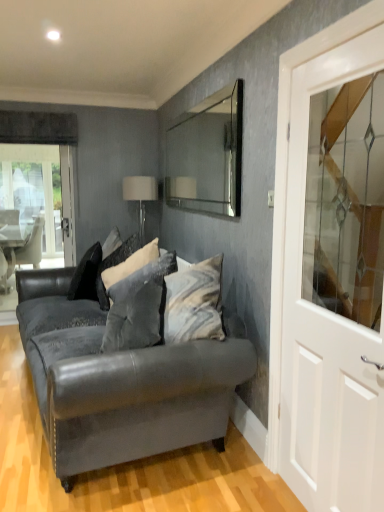
Measure the distance between point (123, 320) and camera.

They are 2.34 meters apart.

Image resolution: width=384 pixels, height=512 pixels. Describe the element at coordinates (138, 307) in the screenshot. I see `velvet gray pillow at center, arranged as the 3th pillow when viewed from the back` at that location.

Identify the location of black velvet pillow at center, which is the 1th pillow in back-to-front order. Image resolution: width=384 pixels, height=512 pixels. (86, 275).

What is the approximate height of velvet dark gray couch at center?

The height of velvet dark gray couch at center is 31.44 inches.

What do you see at coordinates (123, 265) in the screenshot? The height and width of the screenshot is (512, 384). I see `velvet gray pillow at center, placed as the second pillow when sorted from back to front` at bounding box center [123, 265].

Locate an element on the screen. This screenshot has height=512, width=384. velvet gray pillow at center, arranged as the 3th pillow when viewed from the back is located at coordinates pos(138,307).

Which is closer to the camera, (163, 297) or (319, 411)?

Point (163, 297) is positioned farther from the camera compared to point (319, 411).

Is velvet gray pillow at center, arranged as the first pillow when viewed from the front, next to white glossy door at right?

No, velvet gray pillow at center, arranged as the first pillow when viewed from the front, is not making contact with white glossy door at right.

From the image's perspective, which object appears higher, velvet gray pillow at center, arranged as the first pillow when viewed from the front, or white glossy door at right?

From the image's view, white glossy door at right is above.

Is velvet gray pillow at center, arranged as the first pillow when viewed from the front, situated inside white glossy door at right or outside?

The correct answer is: outside.

Locate an element on the screen. Image resolution: width=384 pixels, height=512 pixels. the 2nd pillow below when counting from the black velvet pillow at center, which is the 1th pillow in back-to-front order (from the image's perspective) is located at coordinates (x=138, y=307).

Is velvet gray pillow at center, arranged as the 3th pillow when viewed from the back, facing towards black velvet pillow at center, which is the 1th pillow in back-to-front order?

No, velvet gray pillow at center, arranged as the 3th pillow when viewed from the back, is not turned towards black velvet pillow at center, which is the 1th pillow in back-to-front order.

Could you measure the distance between velvet gray pillow at center, arranged as the first pillow when viewed from the front, and black velvet pillow at center, acting as the third pillow starting from the front?

velvet gray pillow at center, arranged as the first pillow when viewed from the front, is 38.43 inches away from black velvet pillow at center, acting as the third pillow starting from the front.

Is white fabric lampshade at upper center turned away from velvet dark gray couch at center?

white fabric lampshade at upper center is not turned away from velvet dark gray couch at center.

From a real-world perspective, is white fabric lampshade at upper center above or below velvet dark gray couch at center?

white fabric lampshade at upper center is situated higher than velvet dark gray couch at center in the real world.

Consider the image. Which object is positioned more to the right, white fabric lampshade at upper center or velvet dark gray couch at center?

Positioned to the right is white fabric lampshade at upper center.

Do you think velvet gray pillow at center, placed as the second pillow when sorted from back to front, is within white fabric lampshade at upper center, or outside of it?

velvet gray pillow at center, placed as the second pillow when sorted from back to front, cannot be found inside white fabric lampshade at upper center.

In the scene shown: Could you tell me if velvet gray pillow at center, arranged as the 2th pillow when viewed from the front, is turned towards white fabric lampshade at upper center?

No.

Which is in front, point (148, 251) or point (133, 186)?

Positioned in front is point (148, 251).

Is black velvet pillow at center, which is the 1th pillow in back-to-front order, facing towards velvet dark gray couch at center?

Yes, black velvet pillow at center, which is the 1th pillow in back-to-front order, is facing velvet dark gray couch at center.

From a real-world perspective, is black velvet pillow at center, which is the 1th pillow in back-to-front order, positioned over velvet dark gray couch at center based on gravity?

Yes.

Does black velvet pillow at center, which is the 1th pillow in back-to-front order, appear on the right side of velvet dark gray couch at center?

No.

Does point (150, 448) appear closer or farther from the camera than point (346, 505)?

Point (150, 448) appears to be farther away from the viewer than point (346, 505).

Is velvet dark gray couch at center further to camera compared to white glossy door at right?

That is True.

Considering the relative positions of velvet dark gray couch at center and white glossy door at right in the image provided, is velvet dark gray couch at center to the left of white glossy door at right from the viewer's perspective?

Correct, you'll find velvet dark gray couch at center to the left of white glossy door at right.

Between white glossy door at right and velvet gray pillow at center, arranged as the first pillow when viewed from the front, which one appears on the right side from the viewer's perspective?

From the viewer's perspective, white glossy door at right appears more on the right side.

Is white glossy door at right directly adjacent to velvet gray pillow at center, arranged as the first pillow when viewed from the front?

No, white glossy door at right is not making contact with velvet gray pillow at center, arranged as the first pillow when viewed from the front.

Which object is wider, white glossy door at right or velvet gray pillow at center, arranged as the 3th pillow when viewed from the back?

velvet gray pillow at center, arranged as the 3th pillow when viewed from the back, is wider.

Where is `pillow that appears below the white glossy door at right (from the image's perspective)`? The width and height of the screenshot is (384, 512). pillow that appears below the white glossy door at right (from the image's perspective) is located at coordinates (138, 307).

From the velvet gray pillow at center, arranged as the 3th pillow when viewed from the back, count the 2nd pillow to the left and point to it. Please provide its 2D coordinates.

[(86, 275)]

Based on their spatial positions, is clear glass mirror at upper center or white glossy door at right further from black velvet pillow at center, which is the 1th pillow in back-to-front order?

white glossy door at right is further to black velvet pillow at center, which is the 1th pillow in back-to-front order.

When comparing their distances from velvet dark gray couch at center, does black velvet pillow at center, which is the 1th pillow in back-to-front order, or velvet gray pillow at center, placed as the second pillow when sorted from back to front, seem further?

black velvet pillow at center, which is the 1th pillow in back-to-front order.

Estimate the real-world distances between objects in this image. Which object is closer to black velvet pillow at center, which is the 1th pillow in back-to-front order, velvet gray pillow at center, arranged as the 3th pillow when viewed from the back, or velvet dark gray couch at center?

velvet gray pillow at center, arranged as the 3th pillow when viewed from the back, is positioned closer to the anchor black velvet pillow at center, which is the 1th pillow in back-to-front order.

Looking at the image, which one is located further to velvet gray pillow at center, arranged as the first pillow when viewed from the front, white glossy door at right or black velvet pillow at center, acting as the third pillow starting from the front?

black velvet pillow at center, acting as the third pillow starting from the front.

Based on their spatial positions, is velvet dark gray couch at center or white glossy door at right further from velvet gray pillow at center, arranged as the first pillow when viewed from the front?

Among the two, white glossy door at right is located further to velvet gray pillow at center, arranged as the first pillow when viewed from the front.

Looking at this image, from the image, which object appears to be farther from velvet dark gray couch at center, velvet gray pillow at center, arranged as the 3th pillow when viewed from the back, or velvet gray pillow at center, arranged as the 2th pillow when viewed from the front?

velvet gray pillow at center, arranged as the 2th pillow when viewed from the front, lies further to velvet dark gray couch at center than the other object.

Considering their positions, is velvet gray pillow at center, arranged as the first pillow when viewed from the front, positioned closer to velvet gray pillow at center, arranged as the 2th pillow when viewed from the front, than black velvet pillow at center, acting as the third pillow starting from the front?

black velvet pillow at center, acting as the third pillow starting from the front, is closer to velvet gray pillow at center, arranged as the 2th pillow when viewed from the front.

When comparing their distances from white glossy door at right, does velvet gray pillow at center, arranged as the 2th pillow when viewed from the front, or clear glass mirror at upper center seem closer?

velvet gray pillow at center, arranged as the 2th pillow when viewed from the front, lies closer to white glossy door at right than the other object.

Locate an element on the screen. The height and width of the screenshot is (512, 384). studio couch between white glossy door at right and white fabric lampshade at upper center along the z-axis is located at coordinates (121, 384).

At what (x,y) coordinates should I click in order to perform the action: click on mirror positioned between white glossy door at right and velvet gray pillow at center, placed as the second pillow when sorted from back to front, from near to far. Please return your answer as a coordinate pair (x, y). The height and width of the screenshot is (512, 384). Looking at the image, I should click on pyautogui.click(x=207, y=157).

Locate an element on the screen. studio couch between white glossy door at right and black velvet pillow at center, which is the 1th pillow in back-to-front order, in the front-back direction is located at coordinates (121, 384).

Find the location of `mirror between velvet dark gray couch at center and velvet gray pillow at center, placed as the second pillow when sorted from back to front, from front to back`. mirror between velvet dark gray couch at center and velvet gray pillow at center, placed as the second pillow when sorted from back to front, from front to back is located at coordinates [x=207, y=157].